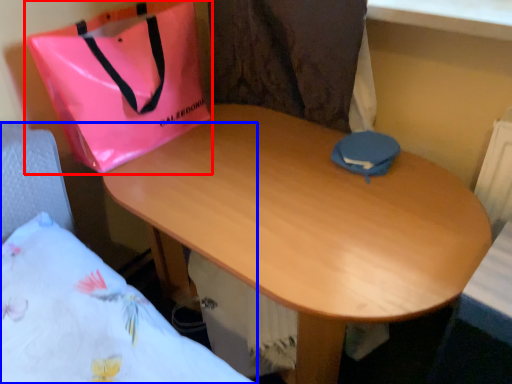
Question: Among these objects, which one is farthest to the camera, handbag (highlighted by a red box) or bed (highlighted by a blue box)?

Choices:
 (A) handbag
 (B) bed

Answer: (A)